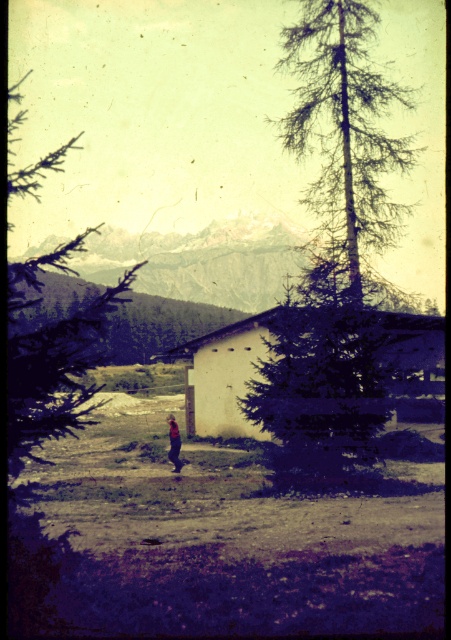
You are a visitor approaching the white matte hut at center and the dark blue jeans at center in the rural scene. Which object would you encounter first as you move towards them?

The white matte hut at center is in front of dark blue jeans at center, so you would encounter the white matte hut at center first.

You are a photographer planning to take a wide shot of the white matte hut at center and dark blue jeans at center. Based on the scene, which object is wider?

The white matte hut at center is wider than the dark blue jeans at center.